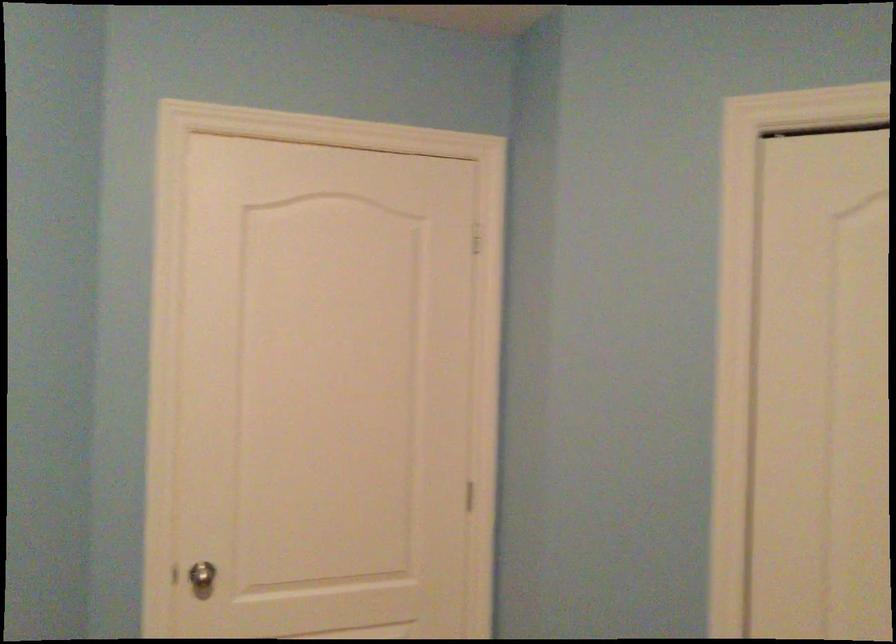
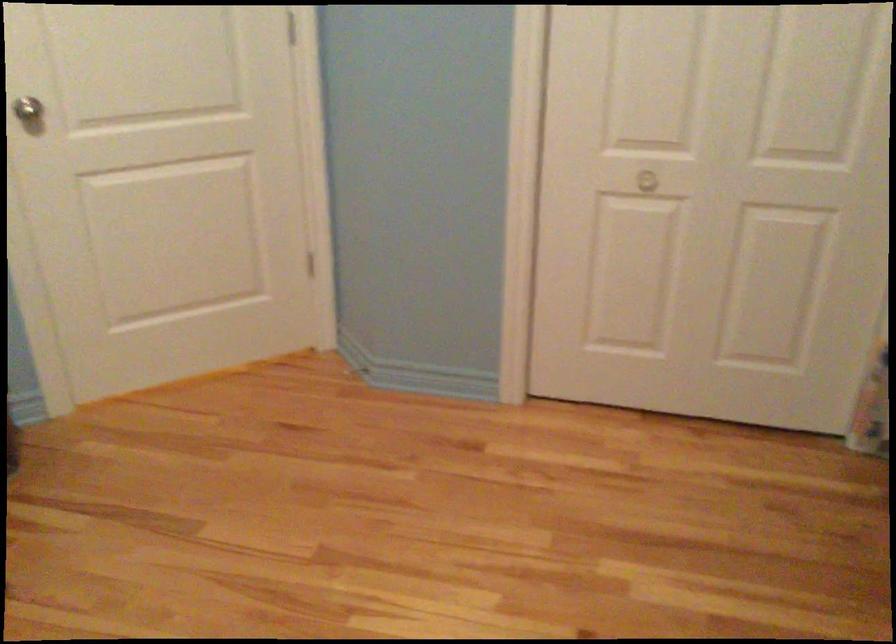
Find the pixel in the second image that matches pixel 203 567 in the first image.

(29, 111)